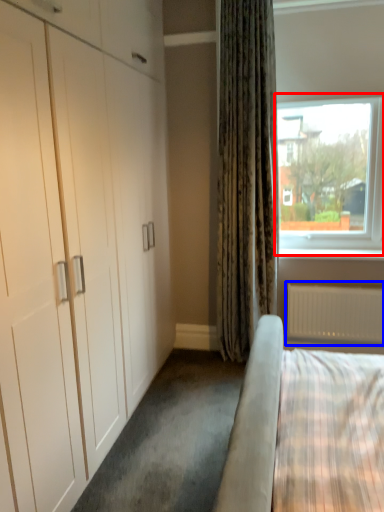
Question: Which object is further to the camera taking this photo, window (highlighted by a red box) or radiator (highlighted by a blue box)?

Choices:
 (A) window
 (B) radiator

Answer: (B)